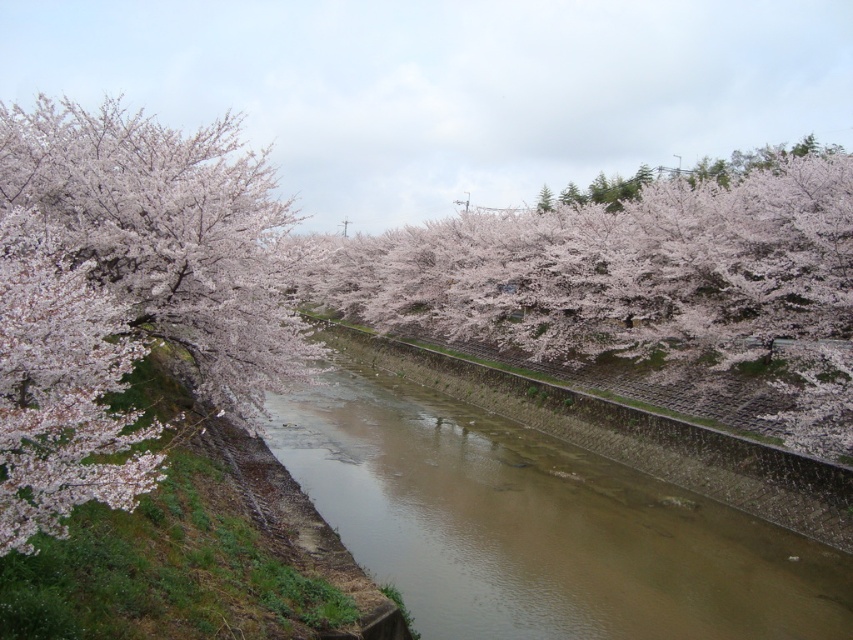
Can you confirm if brown concrete river at center is positioned below pink blossoms at left?

Correct, brown concrete river at center is located below pink blossoms at left.

Who is taller, brown concrete river at center or pink blossoms at left?

With more height is pink blossoms at left.

Image resolution: width=853 pixels, height=640 pixels. Find the location of `brown concrete river at center`. brown concrete river at center is located at coordinates (560, 509).

Locate an element on the screen. This screenshot has width=853, height=640. brown concrete river at center is located at coordinates (560, 509).

This screenshot has width=853, height=640. What do you see at coordinates (641, 294) in the screenshot?
I see `pink blossoms at center` at bounding box center [641, 294].

Between pink blossoms at center and pink blossoms at left, which one appears on the right side from the viewer's perspective?

Positioned to the right is pink blossoms at center.

What do you see at coordinates (641, 294) in the screenshot? I see `pink blossoms at center` at bounding box center [641, 294].

In order to click on pink blossoms at center in this screenshot , I will do `click(641, 294)`.

How much distance is there between brown concrete river at center and pink blossoms at center?

A distance of 50.13 feet exists between brown concrete river at center and pink blossoms at center.

Is brown concrete river at center positioned behind pink blossoms at center?

No, brown concrete river at center is closer to the viewer.

Who is more forward, (477, 627) or (665, 376)?

Positioned in front is point (477, 627).

Where is `brown concrete river at center`? The width and height of the screenshot is (853, 640). brown concrete river at center is located at coordinates (560, 509).